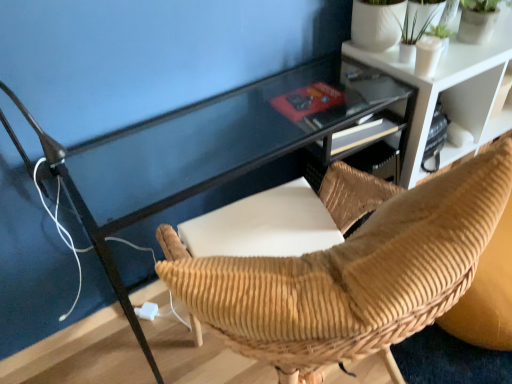
What do you see at coordinates (351, 269) in the screenshot? This screenshot has width=512, height=384. I see `brown corduroy chair at center` at bounding box center [351, 269].

Describe the element at coordinates (418, 18) in the screenshot. I see `green matte plant at upper right` at that location.

Locate an element on the screen. brown corduroy chair at center is located at coordinates (351, 269).

Are white plastic plug at lower center and brown corduroy chair at center making contact?

white plastic plug at lower center and brown corduroy chair at center are clearly separated.

Considering the relative positions of white plastic plug at lower center and brown corduroy chair at center in the image provided, is white plastic plug at lower center to the left of brown corduroy chair at center from the viewer's perspective?

Yes.

Is white plastic plug at lower center taller or shorter than brown corduroy chair at center?

In the image, white plastic plug at lower center appears to be shorter than brown corduroy chair at center.

You are a GUI agent. You are given a task and a screenshot of the screen. Output one action in this format:
    pyautogui.click(x=<x>, y=<y>)
    Task: Click on the shelf that appears below the green matte plant at upper right (from the image's perspective)
    Image resolution: width=512 pixels, height=384 pixels.
    Given the screenshot: What is the action you would take?
    (451, 93)

Is green matte plant at upper right positioned with its back to white textured shelf at upper right?

That's not correct — green matte plant at upper right is not looking away from white textured shelf at upper right.

Considering the relative positions of green matte plant at upper right and white textured shelf at upper right in the image provided, is green matte plant at upper right behind white textured shelf at upper right?

No, green matte plant at upper right is in front of white textured shelf at upper right.

Does green matte plant at upper right appear on the left side of white textured shelf at upper right?

Yes.

Choose the correct answer: Is brown corduroy chair at center inside white textured shelf at upper right or outside it?

brown corduroy chair at center lies outside white textured shelf at upper right.

From the picture: Measure the distance from brown corduroy chair at center to white textured shelf at upper right.

They are 33.88 inches apart.

Considering the positions of objects brown corduroy chair at center and white textured shelf at upper right in the image provided, who is in front, brown corduroy chair at center or white textured shelf at upper right?

Positioned in front is brown corduroy chair at center.

Find the location of a particular element. Image resolution: width=512 pixels, height=384 pixels. shelf on the right of brown corduroy chair at center is located at coordinates (451, 93).

Is white plastic plug at lower center completely or partially inside brown corduroy chair at center?

Actually, white plastic plug at lower center is outside brown corduroy chair at center.

Is brown corduroy chair at center looking in the opposite direction of white plastic plug at lower center?

No, white plastic plug at lower center is not at the back of brown corduroy chair at center.

Between brown corduroy chair at center and white plastic plug at lower center, which one has less height?

With less height is white plastic plug at lower center.

Can you confirm if brown corduroy chair at center is smaller than white plastic plug at lower center?

No, brown corduroy chair at center is not smaller than white plastic plug at lower center.

Does white plastic plug at lower center touch green matte plant at upper right?

white plastic plug at lower center and green matte plant at upper right are not in contact.

From a real-world perspective, is white plastic plug at lower center physically located above or below green matte plant at upper right?

Clearly, from a real-world perspective, white plastic plug at lower center is below green matte plant at upper right.

Is point (147, 307) positioned behind point (400, 25)?

Yes, point (147, 307) is behind point (400, 25).

From the picture: Which of these two, white plastic plug at lower center or green matte plant at upper right, is wider?

Wider between the two is green matte plant at upper right.

From the picture: Does brown corduroy chair at center appear on the right side of green matte plant at upper right?

No, brown corduroy chair at center is not to the right of green matte plant at upper right.

From the picture: Which is farther from the camera, (390, 236) or (411, 31)?

The point (411, 31) is behind.

Is brown corduroy chair at center positioned behind green matte plant at upper right?

That is False.

Is white textured shelf at upper right shorter than brown corduroy chair at center?

Correct, white textured shelf at upper right is not as tall as brown corduroy chair at center.

Identify the location of shelf lying above the brown corduroy chair at center (from the image's perspective). The image size is (512, 384). (451, 93).

Choose the correct answer: Is white textured shelf at upper right inside brown corduroy chair at center or outside it?

white textured shelf at upper right is located beyond the bounds of brown corduroy chair at center.

Can you confirm if white textured shelf at upper right is bigger than brown corduroy chair at center?

No.

Locate an element on the screen. This screenshot has height=384, width=512. plug below the brown corduroy chair at center (from a real-world perspective) is located at coordinates (147, 311).

Locate an element on the screen. The width and height of the screenshot is (512, 384). shelf on the right of green matte plant at upper right is located at coordinates (451, 93).

Looking at this image, when comparing their distances from brown corduroy chair at center, does white textured shelf at upper right or white plastic plug at lower center seem closer?

white textured shelf at upper right is positioned closer to the anchor brown corduroy chair at center.

Estimate the real-world distances between objects in this image. Which object is closer to green matte plant at upper right, white plastic plug at lower center or white textured shelf at upper right?

white textured shelf at upper right is positioned closer to the anchor green matte plant at upper right.

Estimate the real-world distances between objects in this image. Which object is closer to white plastic plug at lower center, white textured shelf at upper right or brown corduroy chair at center?

Based on the image, brown corduroy chair at center appears to be nearer to white plastic plug at lower center.

Looking at the image, which one is located closer to green matte plant at upper right, white textured shelf at upper right or white plastic plug at lower center?

white textured shelf at upper right.

Looking at the image, which one is located closer to white plastic plug at lower center, brown corduroy chair at center or white textured shelf at upper right?

brown corduroy chair at center is closer to white plastic plug at lower center.

When comparing their distances from white textured shelf at upper right, does green matte plant at upper right or brown corduroy chair at center seem further?

brown corduroy chair at center is further to white textured shelf at upper right.

Based on their spatial positions, is white textured shelf at upper right or brown corduroy chair at center closer to green matte plant at upper right?

The object closer to green matte plant at upper right is white textured shelf at upper right.

Estimate the real-world distances between objects in this image. Which object is closer to brown corduroy chair at center, green matte plant at upper right or white plastic plug at lower center?

green matte plant at upper right is positioned closer to the anchor brown corduroy chair at center.

Find the location of a particular element. shelf between green matte plant at upper right and brown corduroy chair at center in the up-down direction is located at coordinates coord(451,93).

Where is `plant situated between white plastic plug at lower center and white textured shelf at upper right from left to right`? plant situated between white plastic plug at lower center and white textured shelf at upper right from left to right is located at coordinates (418, 18).

Locate an element on the screen. chair located between white plastic plug at lower center and white textured shelf at upper right in the left-right direction is located at coordinates (351, 269).

You are a GUI agent. You are given a task and a screenshot of the screen. Output one action in this format:
    pyautogui.click(x=<x>, y=<y>)
    Task: Click on the plant between brown corduroy chair at center and white plastic plug at lower center in the front-back direction
    
    Given the screenshot: What is the action you would take?
    pyautogui.click(x=418, y=18)